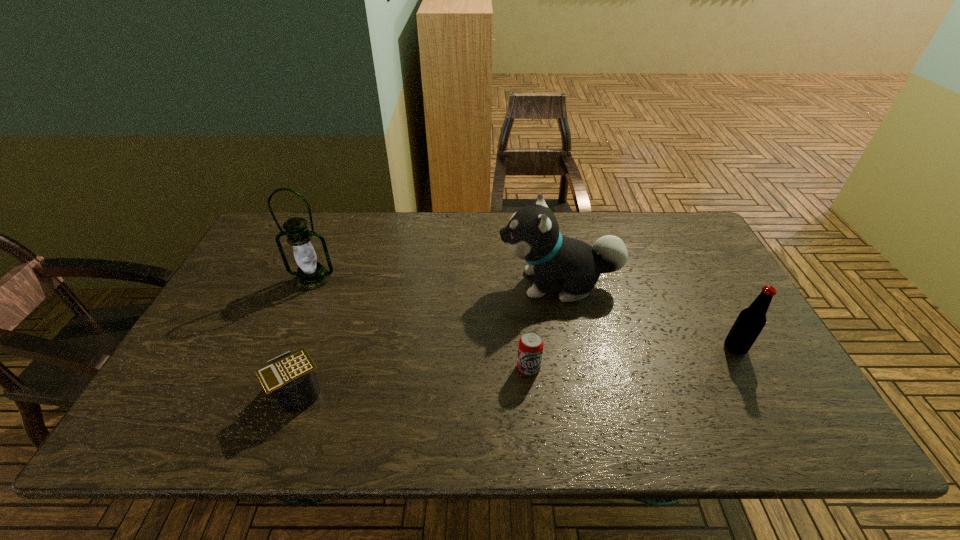
Identify the location of vacant space that is in between the third farthest object and the puppy. (647, 316).

Locate which object ranks third in proximity to the calculator. Please provide its 2D coordinates. Your answer should be formatted as a tuple, i.e. [(x, y)], where the tuple contains the x and y coordinates of a point satisfying the conditions above.

[(532, 234)]

Locate an element on the screen. The width and height of the screenshot is (960, 540). object that ranks as the third closest to the calculator is located at coordinates (532, 234).

Locate an element on the screen. free space that satisfies the following two spatial constraints: 1. at the face of the puppy; 2. on the surface of the soda can is located at coordinates (575, 368).

The height and width of the screenshot is (540, 960). In order to click on vacant area that satisfies the following two spatial constraints: 1. on the side where the calculator emits light; 2. on the right side of the lantern in this screenshot , I will do `click(265, 393)`.

Image resolution: width=960 pixels, height=540 pixels. In order to click on vacant region that satisfies the following two spatial constraints: 1. at the face of the puppy; 2. on the surface of the soda can in this screenshot , I will do `click(575, 368)`.

This screenshot has width=960, height=540. I want to click on vacant region that satisfies the following two spatial constraints: 1. at the face of the puppy; 2. on the back side of the beer bottle, so click(571, 348).